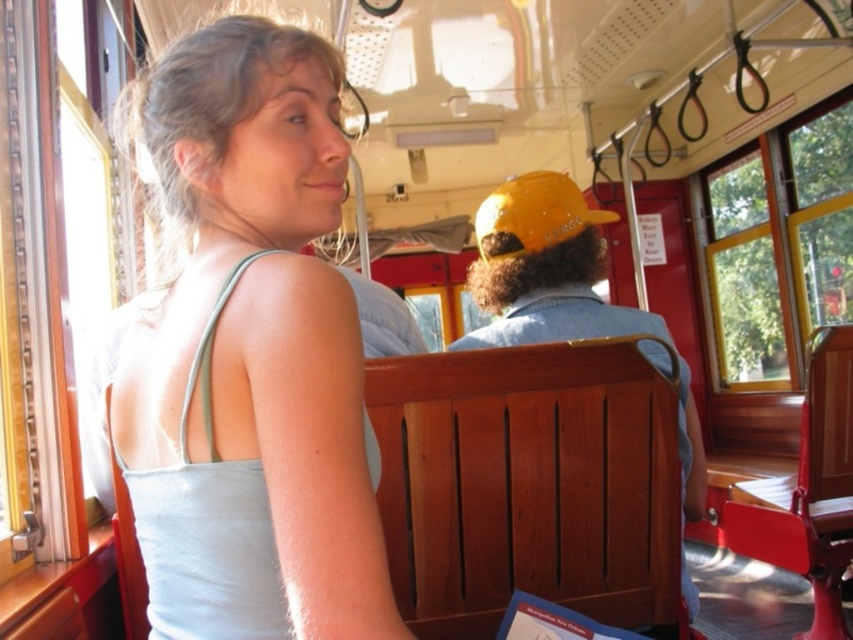
In the scene shown: You are a photographer positioned at the front of the vintage streetcar. You want to take a photo that includes both the white matte tank top at upper left and the wooden bench at center. Which object should you adjust your focus on first to ensure both are in clear view?

Since the white matte tank top at upper left is closer to the viewer than the wooden bench at center, you should focus on the white matte tank top at upper left first to ensure depth of field captures both objects clearly.

You are a tailor who needs to determine if the white matte tank top at upper left can be placed on the wooden bench at center without exceeding its width. Based on the scene description, can the tank top fit on the bench?

The white matte tank top at upper left is narrower than the wooden bench at center, so it can fit on the bench.

You are a photographer positioned in the vintage streetcar. You notice the white matte tank top at upper left and the wooden bench at center. Which object is higher in the image?

The white matte tank top at upper left is above the wooden bench at center, so it is higher in the image.